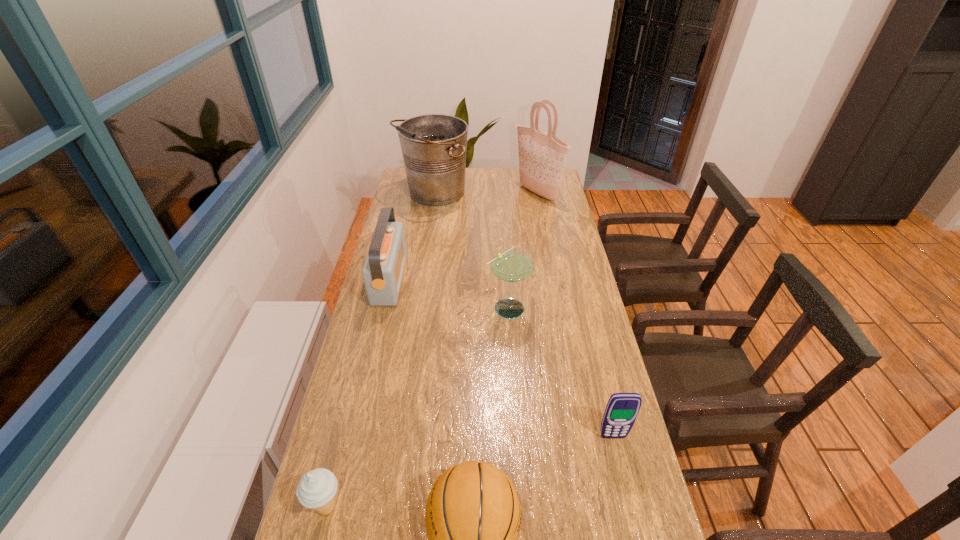
In order to click on the closest object to the tallest object in this screenshot , I will do `click(433, 146)`.